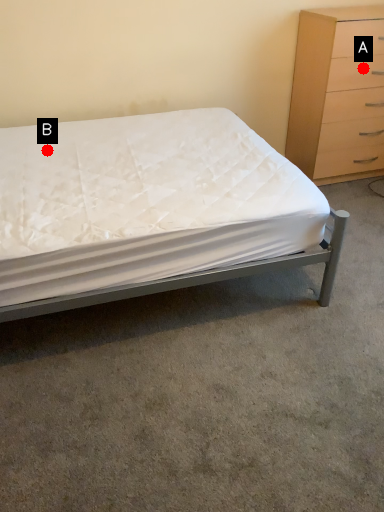
Question: Two points are circled on the image, labeled by A and B beside each circle. Among these points, which one is farthest from the camera?

Choices:
 (A) A is further
 (B) B is further

Answer: (A)